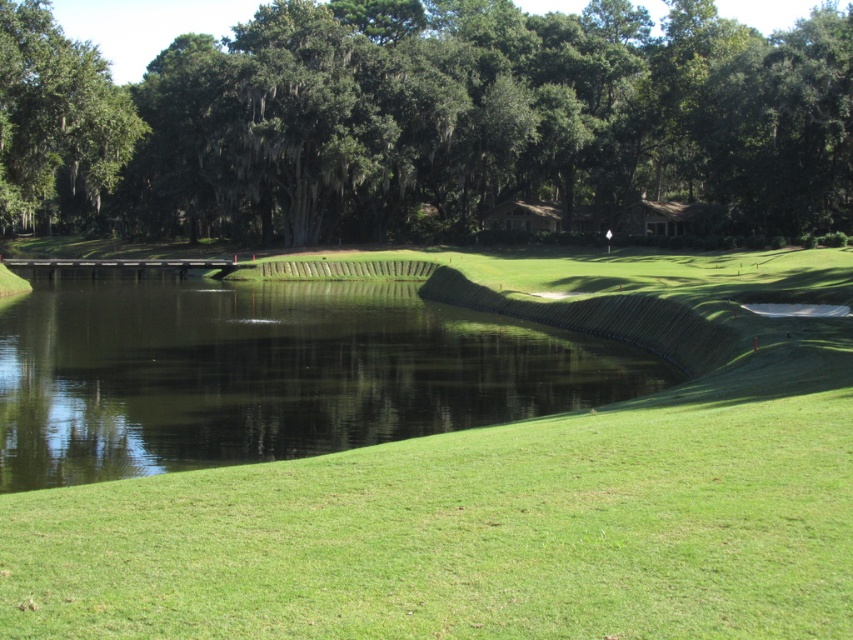
Question: Which of the following is the closest to the observer?

Choices:
 (A) green leafy tree at upper center
 (B) green leafy tree at upper left
 (C) green grassy bank at lower left

Answer: (C)

Question: Among these points, which one is nearest to the camera?

Choices:
 (A) pyautogui.click(x=20, y=176)
 (B) pyautogui.click(x=247, y=451)
 (C) pyautogui.click(x=39, y=161)

Answer: (B)

Question: Which of the following is the closest to the observer?

Choices:
 (A) (103, 112)
 (B) (526, 33)

Answer: (A)

Question: Can you confirm if green leafy tree at upper center is wider than green grassy bank at lower left?

Choices:
 (A) no
 (B) yes

Answer: (B)

Question: Can you confirm if green leafy tree at upper center is smaller than green grassy bank at lower left?

Choices:
 (A) yes
 (B) no

Answer: (B)

Question: Is green leafy tree at upper center to the right of green leafy tree at upper left from the viewer's perspective?

Choices:
 (A) no
 (B) yes

Answer: (B)